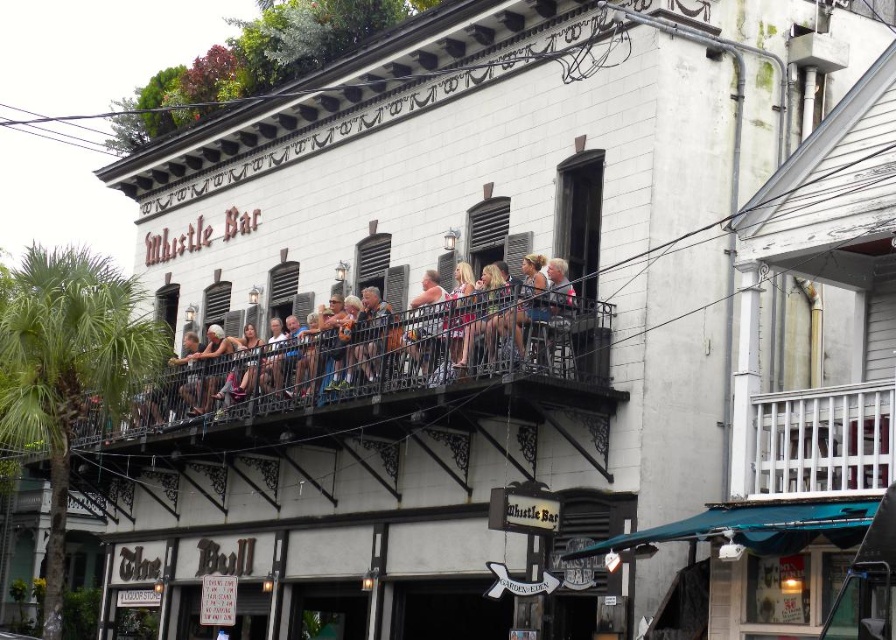
Question: Is matte black balcony railing at center to the right of green leafy palm tree at left from the viewer's perspective?

Choices:
 (A) yes
 (B) no

Answer: (A)

Question: Which object is closer to the camera taking this photo?

Choices:
 (A) green leafy palm tree at left
 (B) matte pink tank top at center
 (C) matte black balcony railing at center

Answer: (C)

Question: Does white wooden railing at upper center appear on the right side of matte pink tank top at center?

Choices:
 (A) no
 (B) yes

Answer: (B)

Question: Does matte black balcony railing at center have a smaller size compared to white wooden railing at upper center?

Choices:
 (A) no
 (B) yes

Answer: (A)

Question: Which object appears closest to the camera in this image?

Choices:
 (A) matte black balcony railing at center
 (B) green leafy palm tree at left

Answer: (A)

Question: Which point appears closest to the camera in this image?

Choices:
 (A) (418, 346)
 (B) (16, 333)
 (C) (565, 326)
 (D) (823, 404)

Answer: (D)